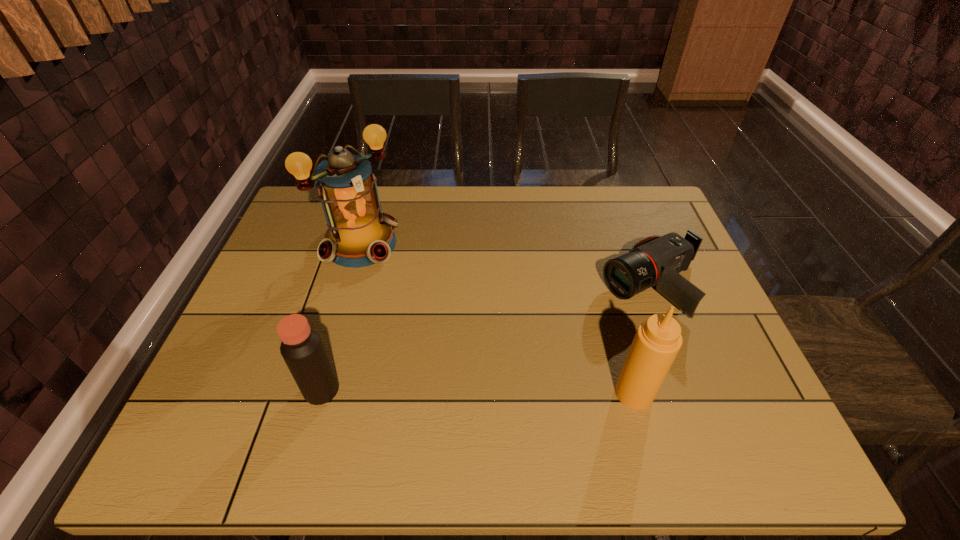
At what (x,y) coordinates should I click in order to perform the action: click on vacant space located 0.170m on the lens of the camcorder. Please return your answer as a coordinate pair (x, y). The height and width of the screenshot is (540, 960). Looking at the image, I should click on (559, 329).

At what (x,y) coordinates should I click in order to perform the action: click on vacant space situated on the lens of the camcorder. Please return your answer as a coordinate pair (x, y). This screenshot has height=540, width=960. Looking at the image, I should click on (485, 365).

Identify the location of object at the far edge. (359, 234).

Locate an element on the screen. vinegar located in the near edge section of the desktop is located at coordinates (302, 349).

In order to click on condiment located at the near edge in this screenshot , I will do `click(658, 339)`.

Locate an element on the screen. The image size is (960, 540). object that is positioned at the left edge is located at coordinates 359,234.

Identify the location of object that is at the right edge. Image resolution: width=960 pixels, height=540 pixels. (655, 260).

Where is `object located in the far left corner section of the desktop`? object located in the far left corner section of the desktop is located at coordinates (359, 234).

Find the location of a particular element. The image size is (960, 540). free region at the far edge of the desktop is located at coordinates pyautogui.click(x=553, y=231).

In the image, there is a desktop. Find the location of `vacant space at the near edge`. vacant space at the near edge is located at coordinates (448, 388).